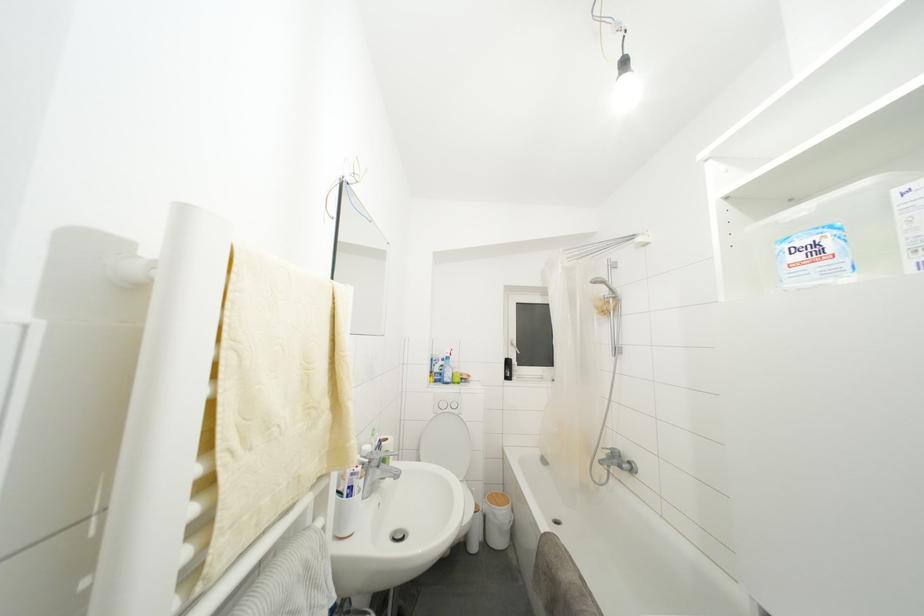
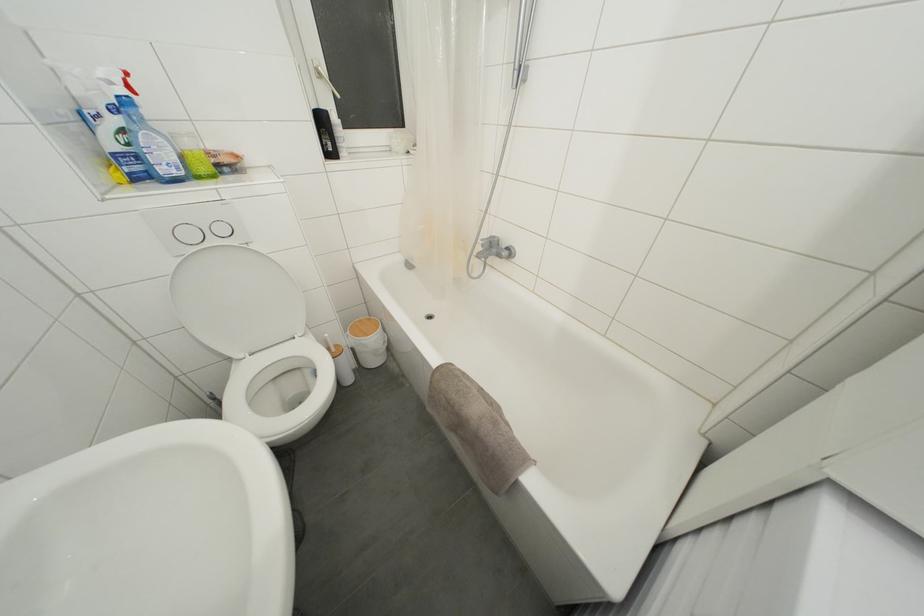
Where in the second image is the point corresponding to [459,376] from the first image?

(193, 148)